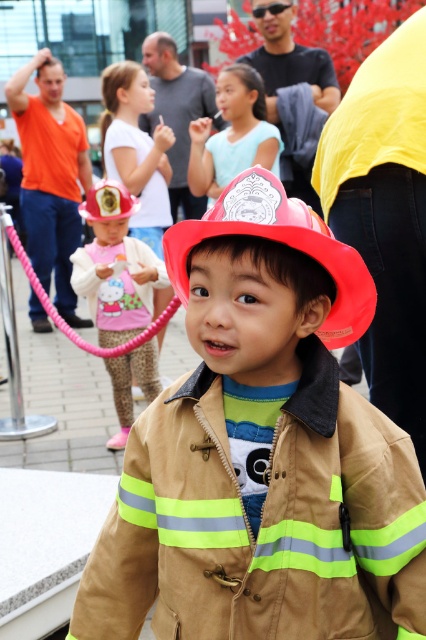
You are a costume designer preparing for a play. You have two helmets available for the firefighter character. The matte red helmet at center and the matte plastic fire helmet at center. Which helmet should you choose if you want the one that stands out more in terms of height?

The matte red helmet at center has a greater height compared to the matte plastic fire helmet at center, so you should choose the matte red helmet at center for the firefighter character to ensure it stands out more in terms of height.

You are taking a photo of the scene and want to focus on both the point at (340, 314) and the point at (273, 109). Which point should you adjust your focus to first to ensure both are in clear view?

You should focus on point (273, 109) first because it is farther from the camera, ensuring that both points will be in focus when using depth of field.

You are a parent trying to find your child who is wearing a firefighter costume. You see the matte pink helmet at center and the matte plastic fireman at center in the image. Which object is located below the other?

The matte pink helmet at center is positioned under the matte plastic fireman at center, so the helmet is below the fireman.